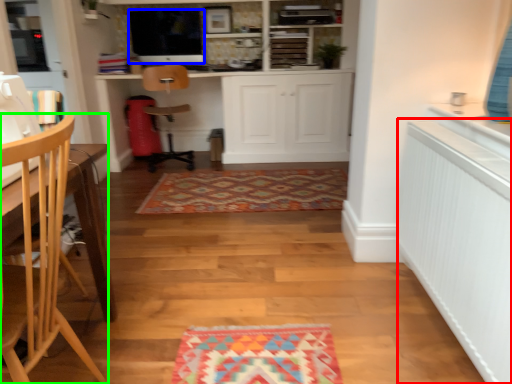
Question: Considering the real-world distances, which object is farthest from radiator (highlighted by a red box)? appliance (highlighted by a blue box) or chair (highlighted by a green box)?

Choices:
 (A) appliance
 (B) chair

Answer: (A)